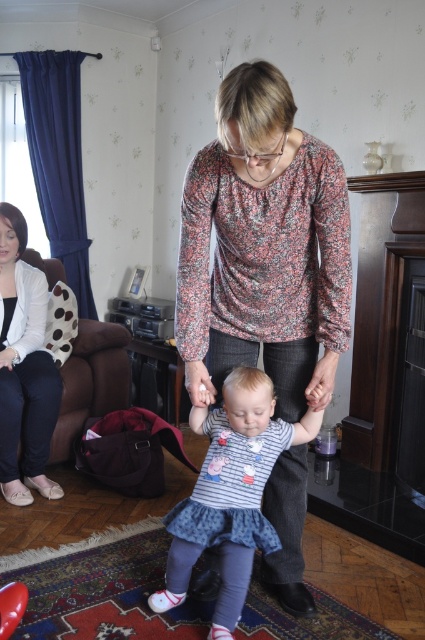
You are a photographer setting up a shoot in this living room. You need to position a new prop between the denim dress at center and the brown fabric armchair at left. Based on their current positions, where should you place the prop so it doesn

The denim dress at center is in front of the brown fabric armchair at left, so placing the prop between them would require positioning it in front of the armchair but behind the dress to maintain the spatial relationship.

You are organizing a clothing rack in a store. You have two items to place on the rack. The denim dress at center and the matte white sweater at left. Which item should you place higher on the rack so that customers can see it easily?

The matte white sweater at left should be placed higher on the rack since it is taller than the denim dress at center, making it more visible to customers.

Consider the image. You are a tailor measuring the distance between two garments in a living room. The garments are the denim dress at center and the matte white sweater at left. Can you fit a 1.2 meter long measuring tape between them without bending it?

The denim dress at center and the matte white sweater at left are 1.14 meters apart from each other, so yes, a 1.2 meter long measuring tape can fit between them without bending since the distance is shorter than the tape length.